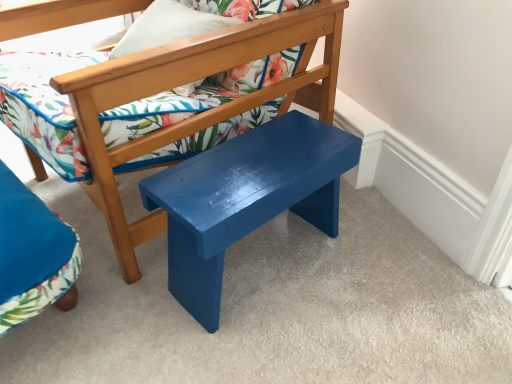
Image resolution: width=512 pixels, height=384 pixels. What are the coordinates of `spots to the right of velvet blue chair at lower left, which appears as the 1th chair when ordered from the bottom` in the screenshot? It's located at (130, 292).